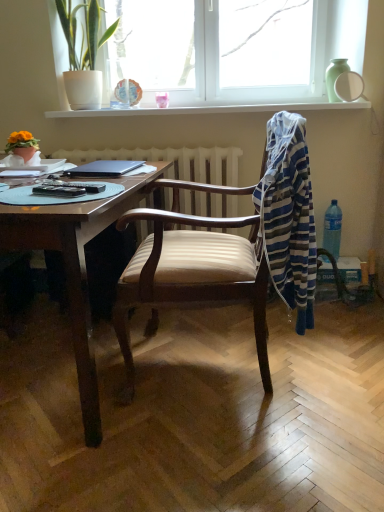
Question: From a real-world perspective, is white glass window at upper center below white glossy mirror at upper right?

Choices:
 (A) yes
 (B) no

Answer: (B)

Question: Is white glass window at upper center behind white glossy mirror at upper right?

Choices:
 (A) no
 (B) yes

Answer: (B)

Question: From the image's perspective, does white glass window at upper center appear lower than white glossy mirror at upper right?

Choices:
 (A) yes
 (B) no

Answer: (B)

Question: Is white glass window at upper center smaller than white glossy mirror at upper right?

Choices:
 (A) yes
 (B) no

Answer: (B)

Question: Is white glass window at upper center aimed at white glossy mirror at upper right?

Choices:
 (A) yes
 (B) no

Answer: (A)

Question: Which is correct: black plastic remote control at table left is inside clear plastic bottle at right, or outside of it?

Choices:
 (A) outside
 (B) inside

Answer: (A)

Question: Is point (61, 188) closer or farther from the camera than point (336, 209)?

Choices:
 (A) farther
 (B) closer

Answer: (B)

Question: Relative to clear plastic bottle at right, is black plastic remote control at table left in front or behind?

Choices:
 (A) behind
 (B) front

Answer: (B)

Question: Considering the positions of black plastic remote control at table left and clear plastic bottle at right in the image, is black plastic remote control at table left wider or thinner than clear plastic bottle at right?

Choices:
 (A) thin
 (B) wide

Answer: (A)

Question: Looking at their shapes, would you say black plastic remote control at table left is wider or thinner than white textured radiator at center?

Choices:
 (A) wide
 (B) thin

Answer: (B)

Question: Visually, is black plastic remote control at table left positioned to the left or to the right of white textured radiator at center?

Choices:
 (A) left
 (B) right

Answer: (A)

Question: Would you say black plastic remote control at table left is inside or outside white textured radiator at center?

Choices:
 (A) inside
 (B) outside

Answer: (B)

Question: Considering their positions, is black plastic remote control at table left located in front of or behind white textured radiator at center?

Choices:
 (A) behind
 (B) front

Answer: (B)

Question: Considering the positions of point (61, 237) and point (344, 49), is point (61, 237) closer or farther from the camera than point (344, 49)?

Choices:
 (A) closer
 (B) farther

Answer: (A)

Question: From the image's perspective, is wooden desk at center located above or below white glass window at upper center?

Choices:
 (A) below
 (B) above

Answer: (A)